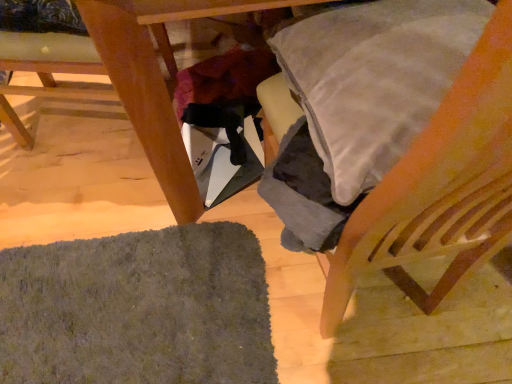
Question: Is wooden table at lower left behind dark gray shaggy mat at lower left?

Choices:
 (A) no
 (B) yes

Answer: (A)

Question: From the image's perspective, is wooden table at lower left under dark gray shaggy mat at lower left?

Choices:
 (A) no
 (B) yes

Answer: (A)

Question: Is wooden table at lower left aimed at dark gray shaggy mat at lower left?

Choices:
 (A) no
 (B) yes

Answer: (A)

Question: Is wooden table at lower left wider than dark gray shaggy mat at lower left?

Choices:
 (A) yes
 (B) no

Answer: (A)

Question: From a real-world perspective, is wooden table at lower left located higher than dark gray shaggy mat at lower left?

Choices:
 (A) yes
 (B) no

Answer: (A)

Question: Would you say dark gray shaggy mat at lower left is part of wooden table at lower left's contents?

Choices:
 (A) no
 (B) yes

Answer: (A)

Question: Can you confirm if dark gray shaggy mat at lower left is smaller than wooden chair at lower left, positioned as the 1th chair in left-to-right order?

Choices:
 (A) yes
 (B) no

Answer: (A)

Question: Does dark gray shaggy mat at lower left contain wooden chair at lower left, the 2th chair in the right-to-left sequence?

Choices:
 (A) yes
 (B) no

Answer: (B)

Question: Considering the relative sizes of dark gray shaggy mat at lower left and wooden chair at lower left, positioned as the 1th chair in left-to-right order, in the image provided, is dark gray shaggy mat at lower left thinner than wooden chair at lower left, positioned as the 1th chair in left-to-right order,?

Choices:
 (A) no
 (B) yes

Answer: (B)

Question: Is dark gray shaggy mat at lower left located outside wooden chair at lower left, positioned as the 1th chair in left-to-right order?

Choices:
 (A) yes
 (B) no

Answer: (A)

Question: Does dark gray shaggy mat at lower left have a larger size compared to wooden chair at lower left, the 2th chair in the right-to-left sequence?

Choices:
 (A) yes
 (B) no

Answer: (B)

Question: Is dark gray shaggy mat at lower left closer to the viewer compared to wooden chair at lower left, positioned as the 1th chair in left-to-right order?

Choices:
 (A) yes
 (B) no

Answer: (B)

Question: Is wooden table at lower left smaller than wooden chair at right, the 2th chair viewed from the left?

Choices:
 (A) yes
 (B) no

Answer: (B)